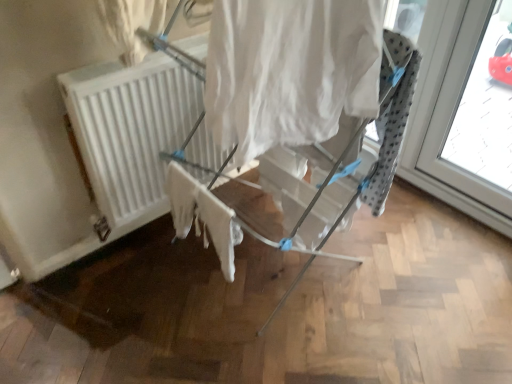
I want to click on vacant space situated on the left part of white fabric drying rack at center, so click(116, 291).